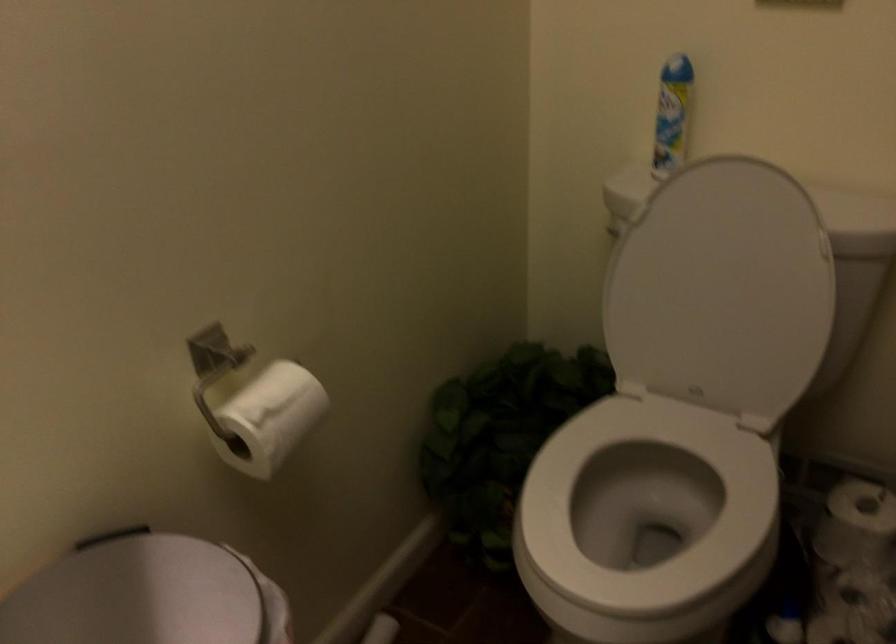
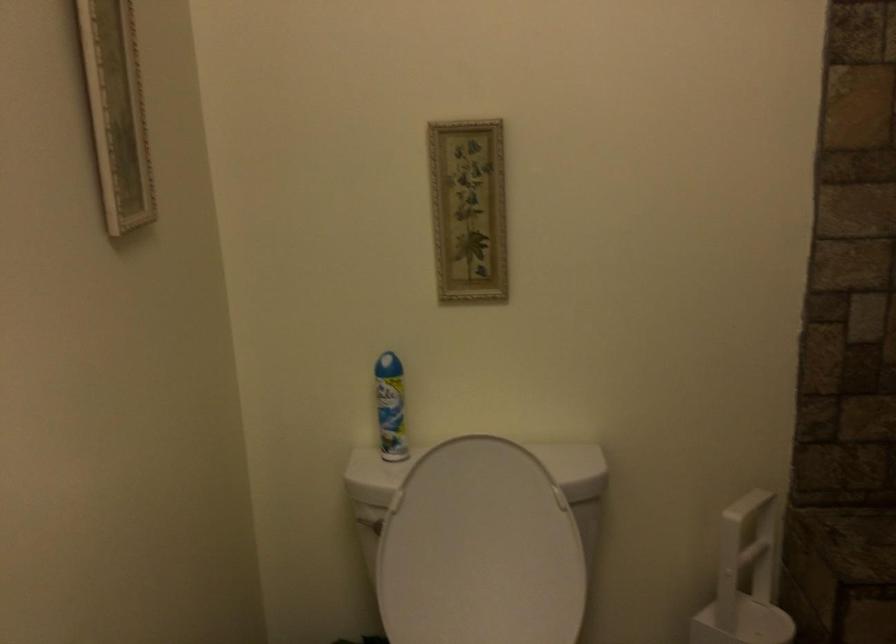
Find the pixel in the second image that matches point 617,231 in the first image.

(368, 522)